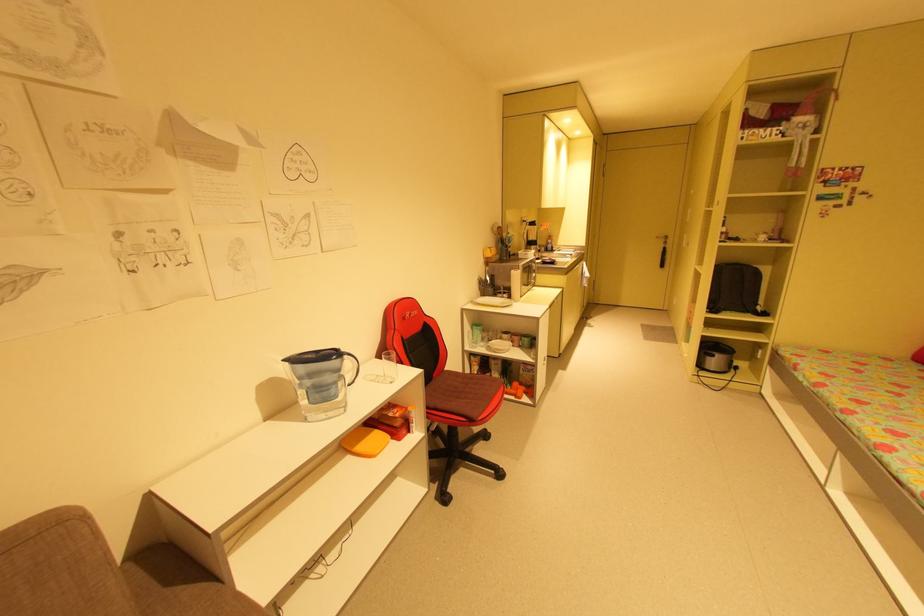
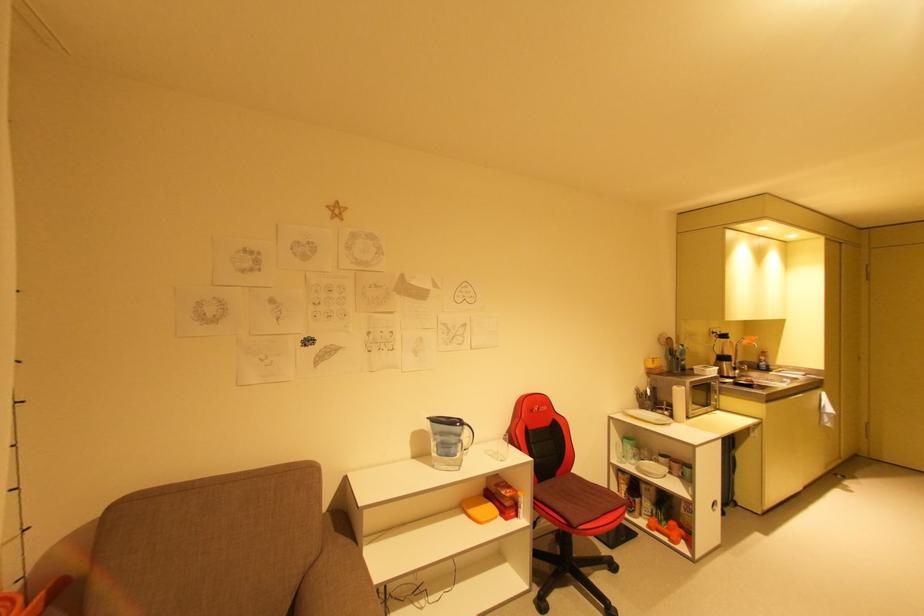
Find the pixel in the second image that matches the point at 521,395 in the first image.

(675, 538)